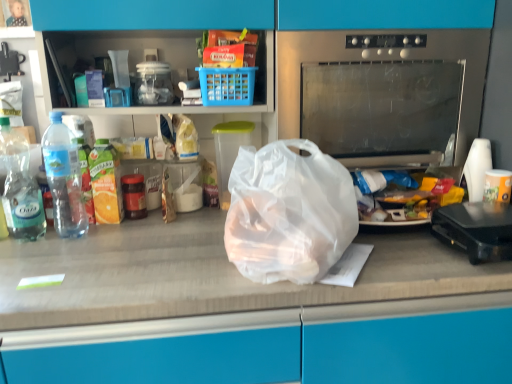
Question: Is black plastic toaster at right further to the viewer compared to transparent plastic container at center?

Choices:
 (A) no
 (B) yes

Answer: (A)

Question: Is black plastic toaster at right oriented away from transparent plastic container at center?

Choices:
 (A) no
 (B) yes

Answer: (A)

Question: Is black plastic toaster at right taller than transparent plastic container at center?

Choices:
 (A) yes
 (B) no

Answer: (B)

Question: Is black plastic toaster at right smaller than transparent plastic container at center?

Choices:
 (A) no
 (B) yes

Answer: (A)

Question: Is black plastic toaster at right completely or partially outside of transparent plastic container at center?

Choices:
 (A) no
 (B) yes

Answer: (B)

Question: Is point (224, 170) closer or farther from the camera than point (212, 92)?

Choices:
 (A) farther
 (B) closer

Answer: (A)

Question: Based on their positions, is transparent plastic container at center located to the left or right of blue plastic basket at upper center?

Choices:
 (A) left
 (B) right

Answer: (B)

Question: Considering the positions of transparent plastic container at center and blue plastic basket at upper center in the image, is transparent plastic container at center taller or shorter than blue plastic basket at upper center?

Choices:
 (A) tall
 (B) short

Answer: (A)

Question: Looking at their shapes, would you say transparent plastic container at center is wider or thinner than blue plastic basket at upper center?

Choices:
 (A) thin
 (B) wide

Answer: (A)

Question: Based on their positions, is stainless steel oven at center located to the left or right of transparent plastic bag at center?

Choices:
 (A) left
 (B) right

Answer: (B)

Question: From the image's perspective, is stainless steel oven at center positioned above or below transparent plastic bag at center?

Choices:
 (A) above
 (B) below

Answer: (A)

Question: Is stainless steel oven at center inside the boundaries of transparent plastic bag at center, or outside?

Choices:
 (A) outside
 (B) inside

Answer: (A)

Question: Looking at the image, does stainless steel oven at center seem bigger or smaller compared to transparent plastic bag at center?

Choices:
 (A) big
 (B) small

Answer: (A)

Question: Considering their positions, is translucent plastic bag at center located in front of or behind clear plastic bottle at left, the 2th bottle when ordered from right to left?

Choices:
 (A) front
 (B) behind

Answer: (A)

Question: Is translucent plastic bag at center taller or shorter than clear plastic bottle at left, which is the first bottle from left to right?

Choices:
 (A) tall
 (B) short

Answer: (A)